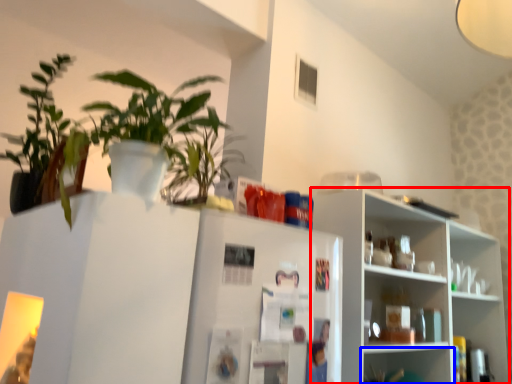
Question: Among these objects, which one is nearest to the camera, shelf (highlighted by a red box) or shelf (highlighted by a blue box)?

Choices:
 (A) shelf
 (B) shelf

Answer: (A)